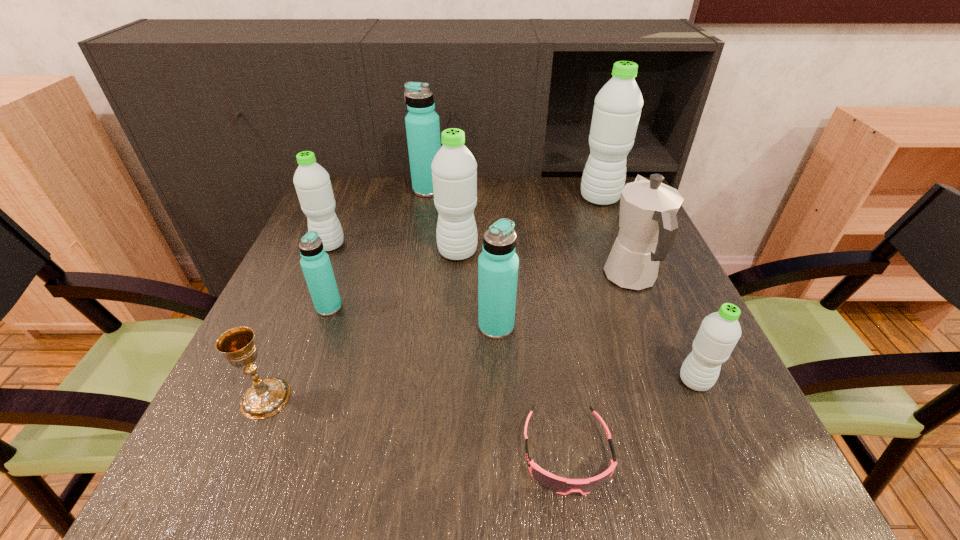
Identify which green water bottle is located as the fourth nearest to the goggles. Please provide its 2D coordinates. Your answer should be formatted as a tuple, i.e. [(x, y)], where the tuple contains the x and y coordinates of a point satisfying the conditions above.

[(617, 109)]

Identify which blue water bottle is the second nearest to the third biggest green water bottle. Please provide its 2D coordinates. Your answer should be formatted as a tuple, i.e. [(x, y)], where the tuple contains the x and y coordinates of a point satisfying the conditions above.

[(422, 123)]

Identify which blue water bottle is the nearest to the second smallest blue water bottle. Please provide its 2D coordinates. Your answer should be formatted as a tuple, i.e. [(x, y)], where the tuple contains the x and y coordinates of a point satisfying the conditions above.

[(315, 263)]

This screenshot has height=540, width=960. Find the location of `vacant position in the image that satisfies the following two spatial constraints: 1. on the back side of the second shortest object; 2. on the right side of the smallest green water bottle`. vacant position in the image that satisfies the following two spatial constraints: 1. on the back side of the second shortest object; 2. on the right side of the smallest green water bottle is located at coordinates (273, 381).

Find the location of `free space that satisfies the following two spatial constraints: 1. on the back side of the second smallest green water bottle; 2. on the right side of the tallest object`. free space that satisfies the following two spatial constraints: 1. on the back side of the second smallest green water bottle; 2. on the right side of the tallest object is located at coordinates (349, 199).